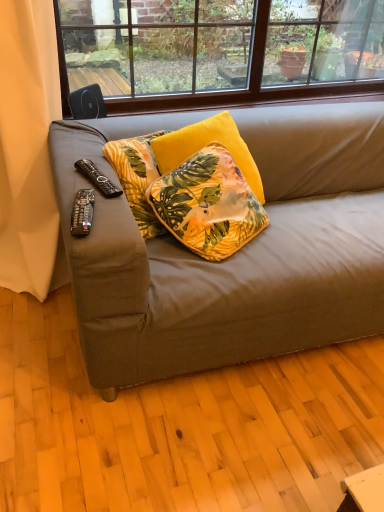
Locate an element on the screen. unoccupied space behind black plastic remote at left, placed as the second remote control when sorted from front to back is located at coordinates point(108,148).